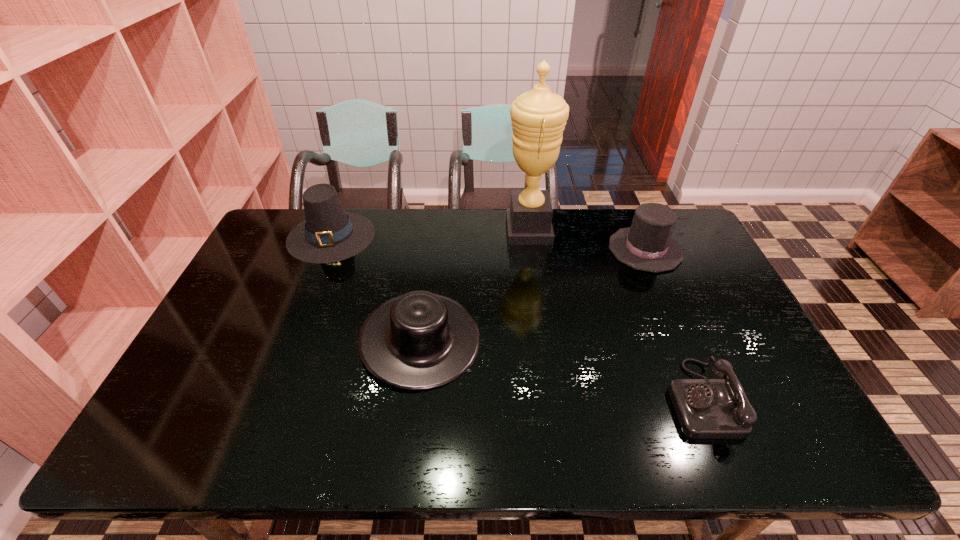
Where is `trophy cup`? The height and width of the screenshot is (540, 960). trophy cup is located at coordinates (538, 117).

Locate an element on the screen. The height and width of the screenshot is (540, 960). the third object from left to right is located at coordinates (538, 117).

Identify the location of the tallest dress hat. (328, 234).

The width and height of the screenshot is (960, 540). In order to click on the fourth shortest object in this screenshot , I will do (328, 234).

The height and width of the screenshot is (540, 960). I want to click on the rightmost dress hat, so click(x=647, y=245).

The height and width of the screenshot is (540, 960). In order to click on the second dress hat from right to left in this screenshot , I will do `click(420, 340)`.

Identify the location of the fourth object from right to left. This screenshot has width=960, height=540. (420, 340).

This screenshot has height=540, width=960. In order to click on telephone in this screenshot , I will do `click(706, 408)`.

This screenshot has width=960, height=540. What are the coordinates of `vacant position located at the front of the trophy cup with handles` in the screenshot? It's located at (470, 230).

Find the location of `free space located at the front of the trophy cup with handles`. free space located at the front of the trophy cup with handles is located at coordinates (420, 230).